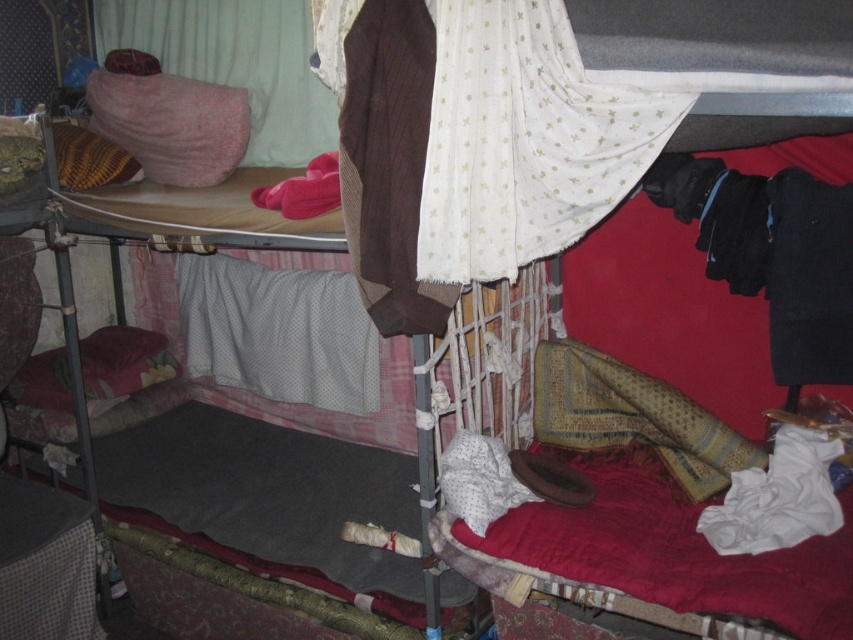
Which is more to the left, velvety pink pillow at upper left or pink soft pillow at upper left?

From the viewer's perspective, pink soft pillow at upper left appears more on the left side.

Does velvety pink pillow at upper left have a larger size compared to pink soft pillow at upper left?

Yes.

Does point (148, 24) lie in front of point (108, 86)?

No, (148, 24) is further to viewer.

The height and width of the screenshot is (640, 853). Find the location of `velvety pink pillow at upper left`. velvety pink pillow at upper left is located at coordinates (236, 64).